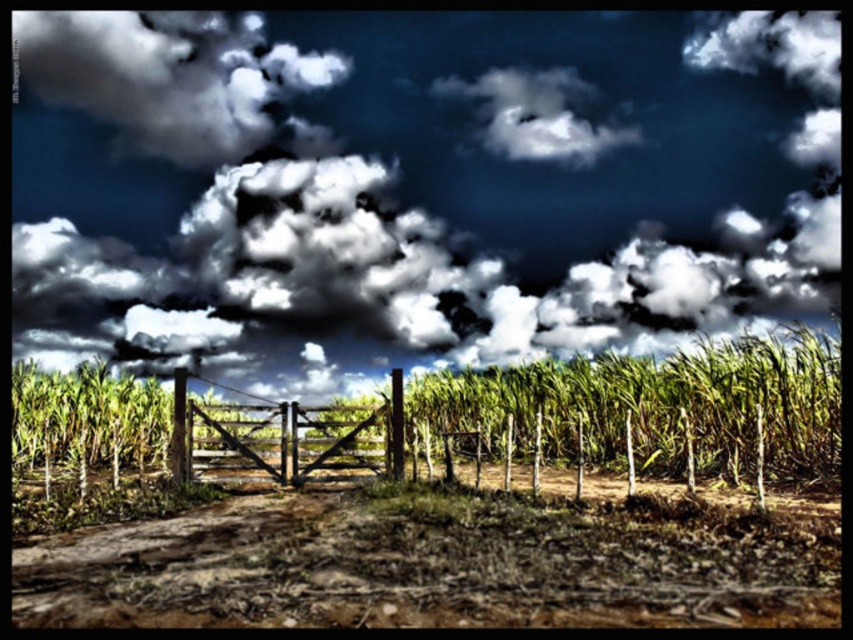
Between wooden gate at center and white fluffy cloud at upper center, which one has less height?

white fluffy cloud at upper center is shorter.

Is wooden gate at center further to the viewer compared to white fluffy cloud at upper center?

No, wooden gate at center is closer to the viewer.

Which is in front, point (349, 440) or point (567, 147)?

Positioned in front is point (349, 440).

Locate an element on the screen. This screenshot has width=853, height=640. wooden gate at center is located at coordinates (283, 436).

Who is more forward, (199, 525) or (480, 99)?

Point (199, 525) is more forward.

Does point (277, 516) come closer to viewer compared to point (527, 150)?

Yes, point (277, 516) is in front of point (527, 150).

Locate an element on the screen. The height and width of the screenshot is (640, 853). brown soil at center is located at coordinates (444, 563).

Who is more forward, (370, 522) or (804, 394)?

Point (370, 522)

Which is behind, point (518, 602) or point (828, 449)?

Point (828, 449)

Which is behind, point (334, 512) or point (691, 422)?

The point (691, 422) is more distant.

Locate an element on the screen. brown soil at center is located at coordinates (444, 563).